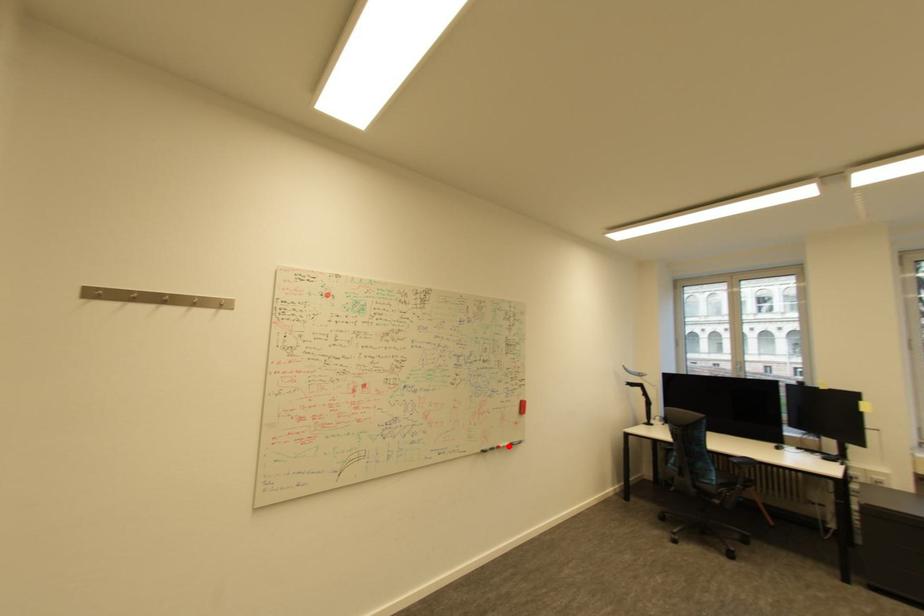
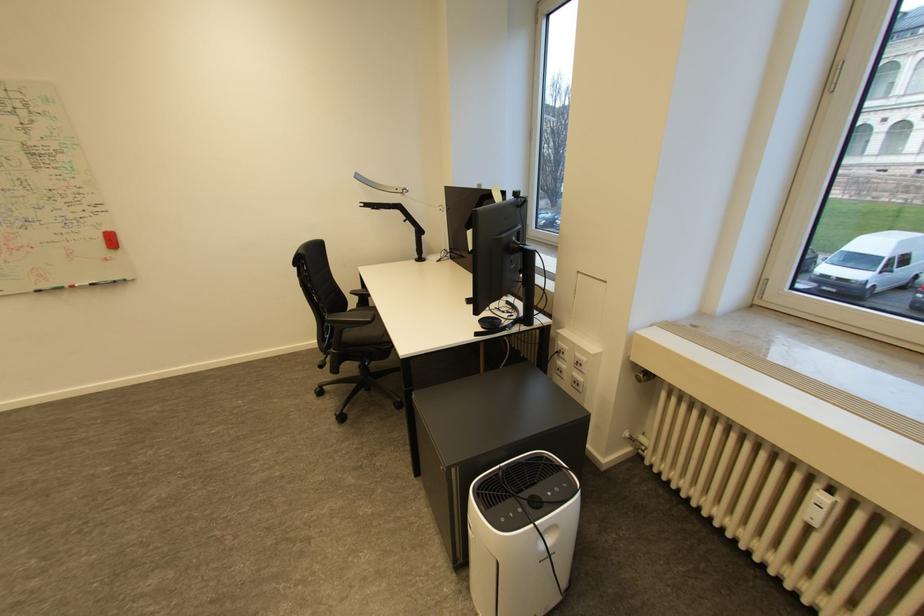
Question: I am providing you with two images of the same scene from different viewpoints. A red point is marked on the first image. Is the red point's position out of view in image 2?

Choices:
 (A) Yes
 (B) No

Answer: (B)